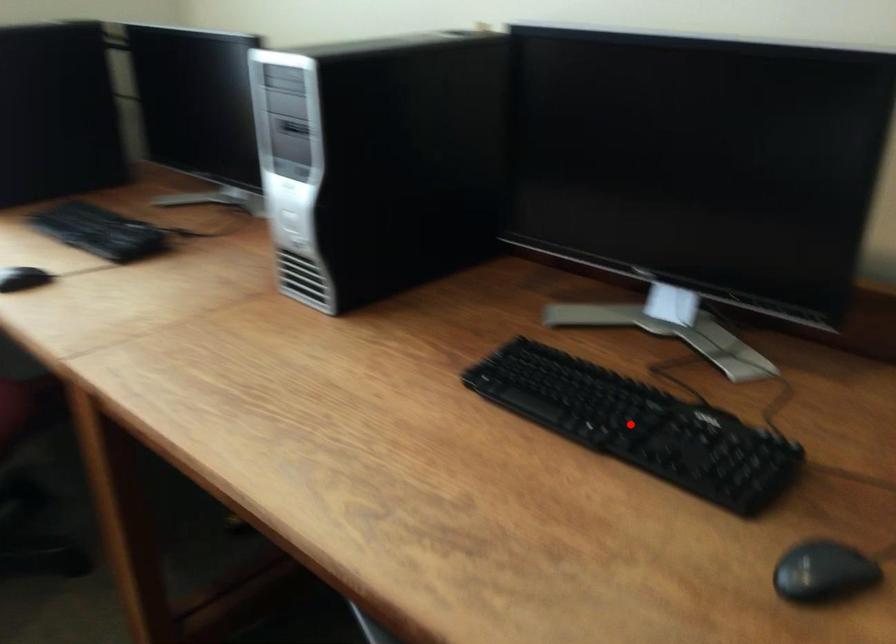
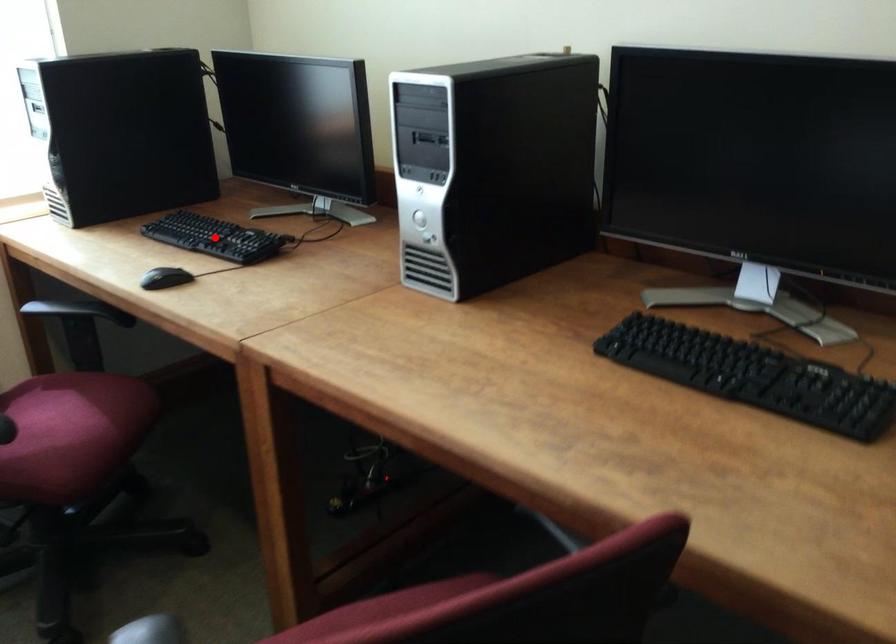
I am providing you with two images of the same scene from different viewpoints. A red point is marked on the first image and another point is marked on the second image. Is the marked point in image1 the same physical position as the marked point in image2?

No